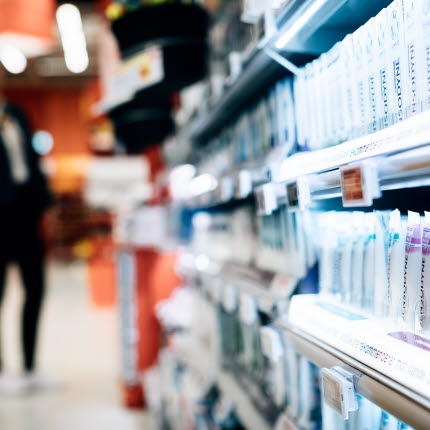
Where is `blurred upper shelf`? blurred upper shelf is located at coordinates (247, 152).